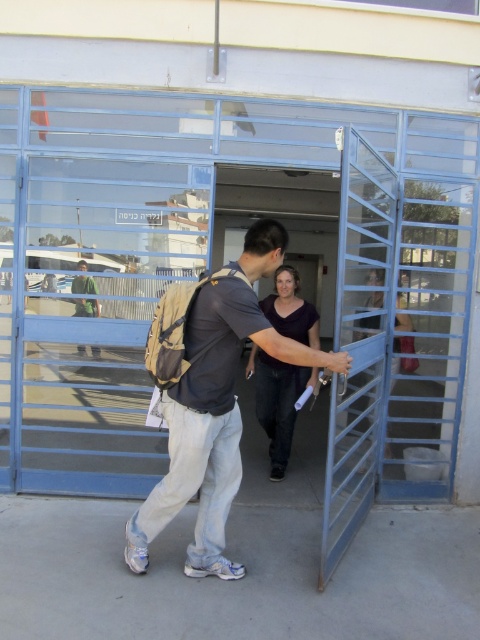
You are a security camera monitoring the entrance. You see a person approaching the blue metallic gate at center with a khaki fabric backpack at center. Can you confirm if the backpack is visible through the gate?

The khaki fabric backpack at center is behind the blue metallic gate at center, so it is not visible through the gate.

You are trying to determine the position of the khaki fabric backpack at center relative to the large glass door. Based on the coordinates provided, can you state where the backpack is positioned in relation to the door?

The khaki fabric backpack at center is located at point coordinates of [211,424], which places it centrally positioned in the scene, likely near the entrance of the large glass door.